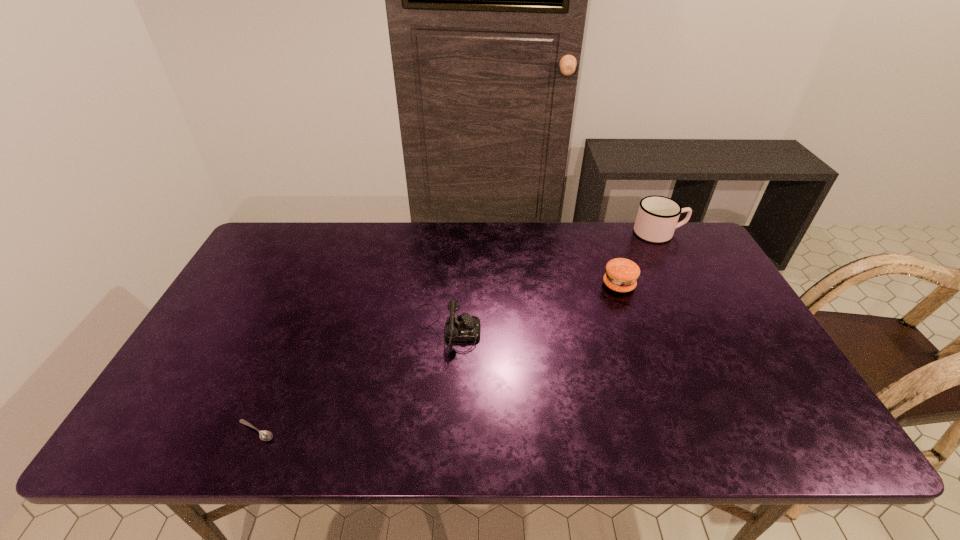
Where is `the rightmost object`? The width and height of the screenshot is (960, 540). the rightmost object is located at coordinates (657, 217).

At what (x,y) coordinates should I click in order to perform the action: click on the farthest object. Please return your answer as a coordinate pair (x, y). Looking at the image, I should click on (657, 217).

Where is `patty`? The height and width of the screenshot is (540, 960). patty is located at coordinates (621, 275).

Identify the location of the third object from left to right. (621, 275).

Where is `the second nearest object`? Image resolution: width=960 pixels, height=540 pixels. the second nearest object is located at coordinates (464, 327).

This screenshot has width=960, height=540. Find the location of `telephone`. telephone is located at coordinates (464, 327).

Find the location of a particular element. the nearest object is located at coordinates (264, 435).

Where is `the shortest object`? Image resolution: width=960 pixels, height=540 pixels. the shortest object is located at coordinates (264, 435).

Find the location of a particular element. The height and width of the screenshot is (540, 960). free region located on the right of the second farthest object is located at coordinates (725, 285).

This screenshot has width=960, height=540. Find the location of `free space located 0.140m on the front-facing side of the second object from left to right`. free space located 0.140m on the front-facing side of the second object from left to right is located at coordinates (533, 329).